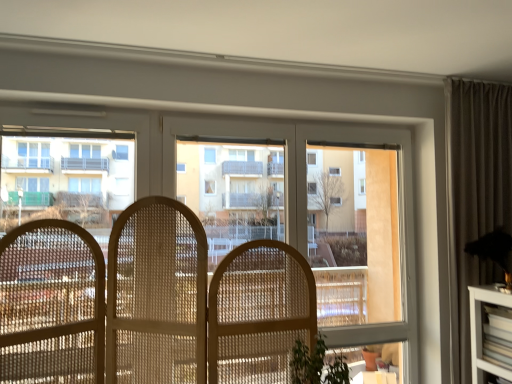
Question: Is white glossy building at left with transparent glass bay window at center?

Choices:
 (A) no
 (B) yes

Answer: (A)

Question: Is transparent glass bay window at center inside white glossy building at left?

Choices:
 (A) yes
 (B) no

Answer: (B)

Question: From a real-world perspective, is white glossy building at left below transparent glass bay window at center?

Choices:
 (A) no
 (B) yes

Answer: (A)

Question: From the image's perspective, is white glossy building at left under transparent glass bay window at center?

Choices:
 (A) no
 (B) yes

Answer: (A)

Question: From the image's perspective, is white glossy building at left over transparent glass bay window at center?

Choices:
 (A) no
 (B) yes

Answer: (B)

Question: From a real-world perspective, is white glossy building at left on transparent glass bay window at center?

Choices:
 (A) yes
 (B) no

Answer: (A)

Question: From the image's perspective, would you say transparent glass window at center is positioned over white glossy building at left?

Choices:
 (A) yes
 (B) no

Answer: (B)

Question: Does transparent glass window at center have a smaller size compared to white glossy building at left?

Choices:
 (A) yes
 (B) no

Answer: (B)

Question: Does transparent glass window at center have a greater width compared to white glossy building at left?

Choices:
 (A) no
 (B) yes

Answer: (A)

Question: Is transparent glass window at center at the left side of white glossy building at left?

Choices:
 (A) no
 (B) yes

Answer: (A)

Question: Is white glossy building at left completely or partially inside transparent glass window at center?

Choices:
 (A) no
 (B) yes

Answer: (A)

Question: Is transparent glass window at center facing towards white glossy building at left?

Choices:
 (A) yes
 (B) no

Answer: (A)

Question: Is transparent glass bay window at center completely or partially inside transparent glass window at center?

Choices:
 (A) yes
 (B) no

Answer: (A)